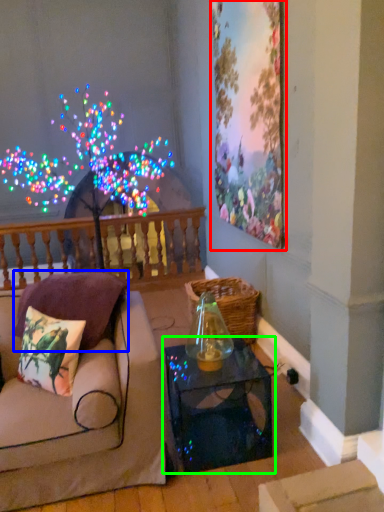
Question: Which object is the closest to the picture frame (highlighted by a red box)? Choose among these: pillow (highlighted by a blue box) or table (highlighted by a green box).

Choices:
 (A) pillow
 (B) table

Answer: (B)